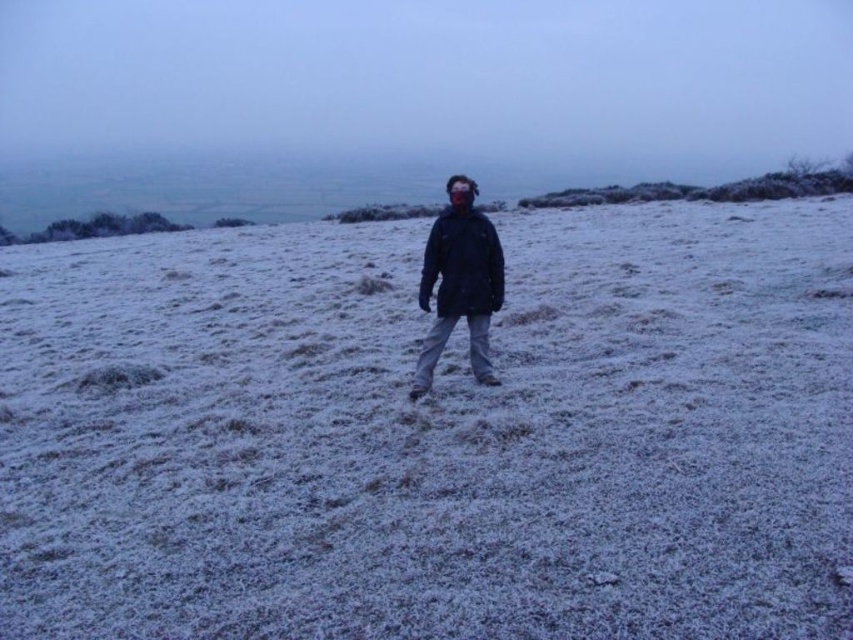
You are a photographer trying to capture the frosty landscape. You notice a specific point marked at coordinates (433, 433). What is located at that point?

The frosted grass at center is located at point (433, 433).

You are a photographer trying to capture the frosted grass at center and the matte black jacket at center in a single shot. Based on their heights, which object will appear larger in the photo?

The frosted grass at center is much taller than the matte black jacket at center, so it will appear larger in the photo.

You are trying to identify the person in the frosty landscape. Which jacket is positioned to the right side of the other? The options are the matte black jacket at center and the dark blue matte jacket at center.

The matte black jacket at center is positioned to the right of the dark blue matte jacket at center.